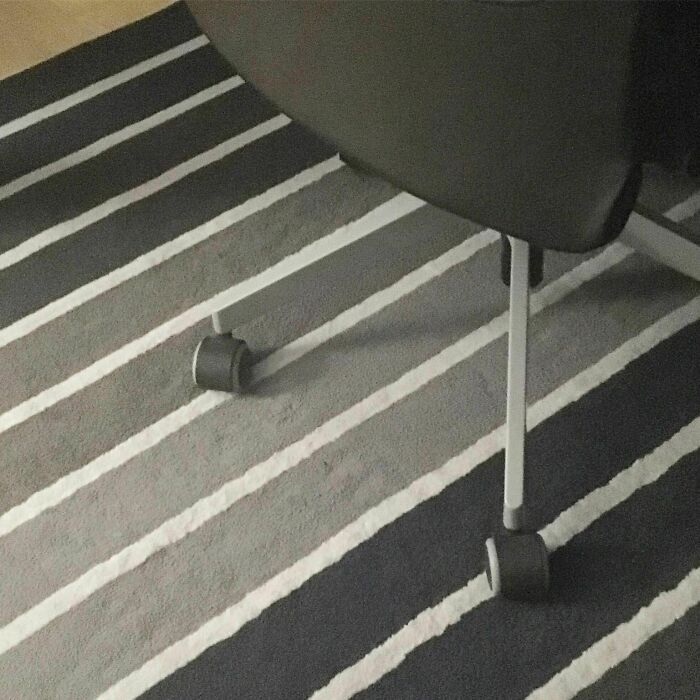
Identify the location of chair let. (516, 448), (516, 335).